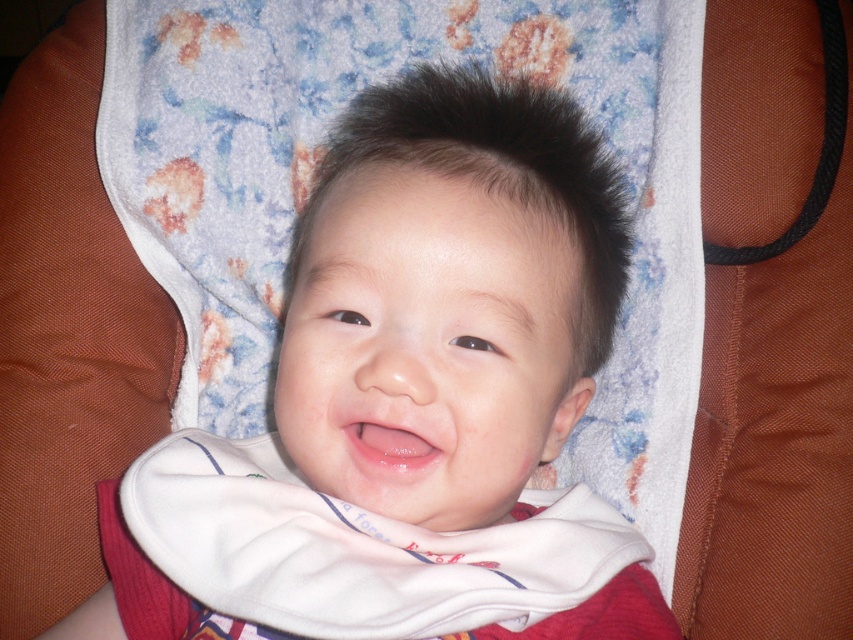
You are a photographer setting up for a baby photoshoot. You notice two bibs in the image, the white soft bib at center and the white cotton bib at center. Which one is positioned higher up?

The white soft bib at center is located above the white cotton bib at center, so it is positioned higher up.

The child in the image is wearing a white cotton bib at center and has pink glossy lips at center. Which object is positioned to the right?

The pink glossy lips at center are positioned to the right of the white cotton bib at center.

You are holding a small toy that needs to be placed exactly at the point marked as point [547,520] in the image. If the toy is 1 inch thick, will it fit without overlapping the child?

The distance of point [547,520] from viewer is 20.54 inches. Since the toy is only 1 inch thick, placing it there would require at least 1 inch of space. Since 20.54 inches is more than 1 inch, the toy will fit without overlapping the child.